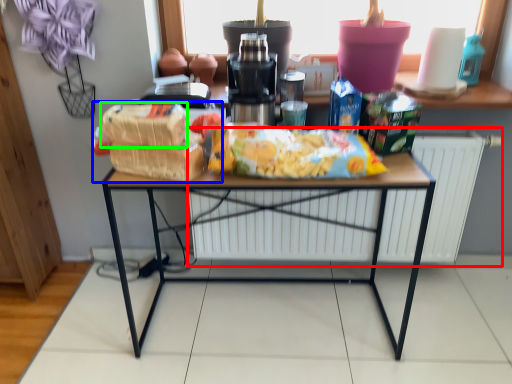
Question: Which is farther away from radiator (highlighted by a red box)? snack (highlighted by a blue box) or cereal (highlighted by a green box)?

Choices:
 (A) snack
 (B) cereal

Answer: (B)